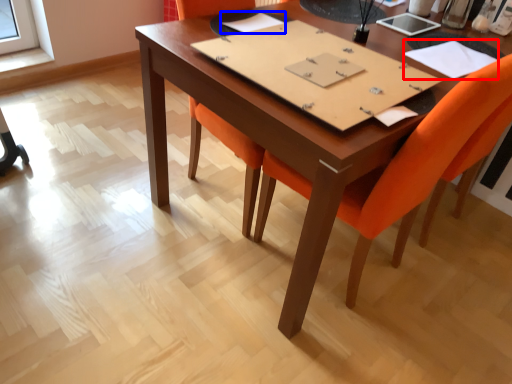
Question: Which object appears farthest to the camera in this image, notebook (highlighted by a red box) or notebook (highlighted by a blue box)?

Choices:
 (A) notebook
 (B) notebook

Answer: (B)